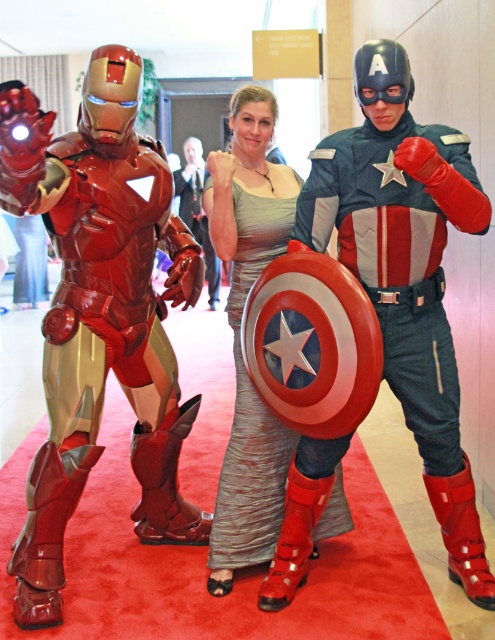
You are standing at the origin point in a coordinate system. There are two points marked in the scene, point (22, 616) and point (368, 180). Which of these two points is closer to you?

Point (368, 180) is closer to you because it is in front of point (22, 616).

What object is located at the coordinates point [99,314] in the image?

The point [99,314] is on shiny metallic armor at left.